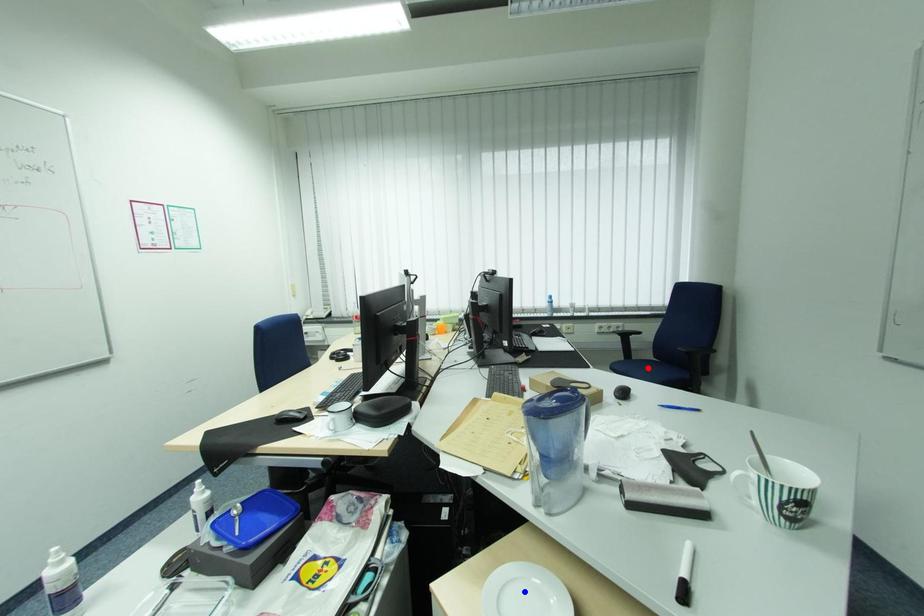
Question: Two points are marked on the image. Which point is closer to the camera?

Choices:
 (A) Blue point is closer.
 (B) Red point is closer.

Answer: (A)